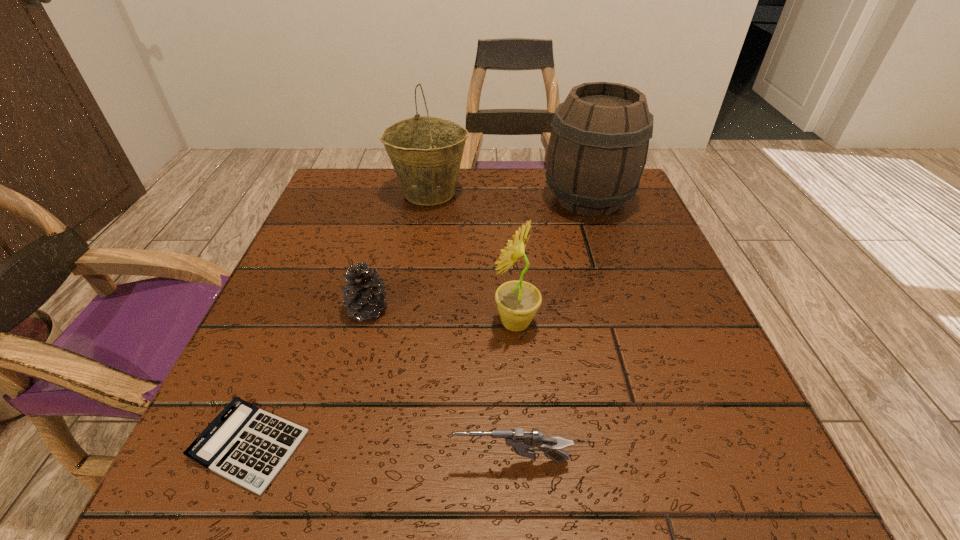
Locate an element on the screen. The height and width of the screenshot is (540, 960). object that is the fourth closest to the left wine bucket is located at coordinates (248, 446).

This screenshot has height=540, width=960. I want to click on blank space that satisfies the following two spatial constraints: 1. on the back side of the shortest object; 2. on the right side of the right wine bucket, so click(349, 199).

Where is `vacant space that satisfies the following two spatial constraints: 1. on the back side of the right wine bucket; 2. on the left side of the pinecone`? vacant space that satisfies the following two spatial constraints: 1. on the back side of the right wine bucket; 2. on the left side of the pinecone is located at coordinates (396, 199).